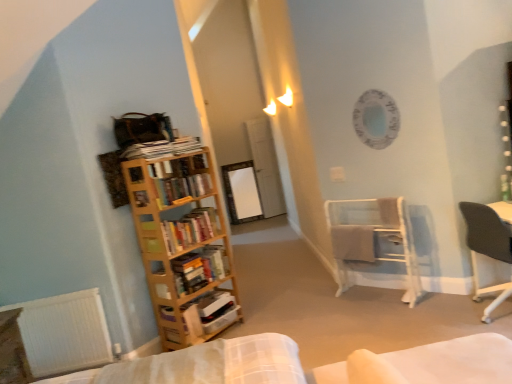
Question: From a real-world perspective, is wooden bookcase at left under wooden bookshelf at left, placed as the 4th book when sorted from bottom to top?

Choices:
 (A) yes
 (B) no

Answer: (A)

Question: Are wooden bookcase at left and wooden bookshelf at left, positioned as the first book in top-to-bottom order, far apart?

Choices:
 (A) yes
 (B) no

Answer: (B)

Question: Is wooden bookcase at left further to the viewer compared to wooden bookshelf at left, positioned as the first book in top-to-bottom order?

Choices:
 (A) yes
 (B) no

Answer: (B)

Question: Is wooden bookcase at left aimed at wooden bookshelf at left, placed as the 4th book when sorted from bottom to top?

Choices:
 (A) no
 (B) yes

Answer: (A)

Question: Considering the relative positions of wooden bookcase at left and wooden bookshelf at left, positioned as the first book in top-to-bottom order, in the image provided, is wooden bookcase at left to the left of wooden bookshelf at left, positioned as the first book in top-to-bottom order, from the viewer's perspective?

Choices:
 (A) no
 (B) yes

Answer: (A)

Question: Is wooden bookshelf at left, positioned as the first book in top-to-bottom order, a part of wooden bookcase at left?

Choices:
 (A) yes
 (B) no

Answer: (B)

Question: From the image's perspective, is white metal towel rack at center right above white cardboard box at left, the fourth book in the top-to-bottom sequence?

Choices:
 (A) yes
 (B) no

Answer: (A)

Question: Does white metal towel rack at center right have a lesser height compared to white cardboard box at left, the fourth book in the top-to-bottom sequence?

Choices:
 (A) yes
 (B) no

Answer: (B)

Question: Considering the relative sizes of white metal towel rack at center right and white cardboard box at left, the fourth book in the top-to-bottom sequence, in the image provided, is white metal towel rack at center right wider than white cardboard box at left, the fourth book in the top-to-bottom sequence,?

Choices:
 (A) yes
 (B) no

Answer: (A)

Question: From a real-world perspective, is white metal towel rack at center right physically below white cardboard box at left, which is the 1th book in bottom-to-top order?

Choices:
 (A) yes
 (B) no

Answer: (B)

Question: Does white metal towel rack at center right have a smaller size compared to white cardboard box at left, which is the 1th book in bottom-to-top order?

Choices:
 (A) yes
 (B) no

Answer: (B)

Question: Is white cardboard box at left, the fourth book in the top-to-bottom sequence, surrounded by white metal towel rack at center right?

Choices:
 (A) no
 (B) yes

Answer: (A)

Question: Can you confirm if wooden table at lower left is bigger than wooden bookshelf at left, the 3th book when ordered from top to bottom?

Choices:
 (A) yes
 (B) no

Answer: (A)